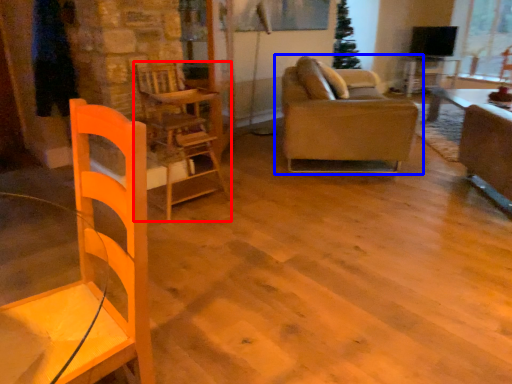
Question: Among these objects, which one is nearest to the camera, chair (highlighted by a red box) or studio couch (highlighted by a blue box)?

Choices:
 (A) chair
 (B) studio couch

Answer: (A)